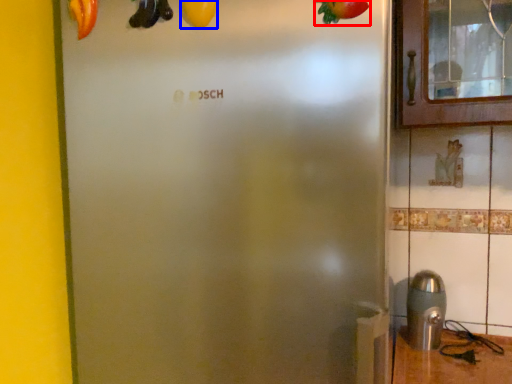
Question: Which object is closer to the camera taking this photo, fruit (highlighted by a red box) or fruit (highlighted by a blue box)?

Choices:
 (A) fruit
 (B) fruit

Answer: (A)